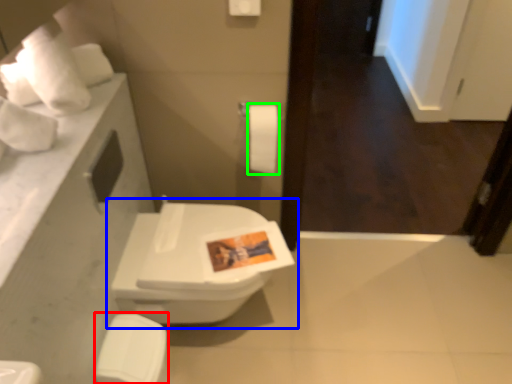
Question: Which is nearer to the porcelain (highlighted by a red box)? toilet (highlighted by a blue box) or toilet paper (highlighted by a green box).

Choices:
 (A) toilet
 (B) toilet paper

Answer: (A)